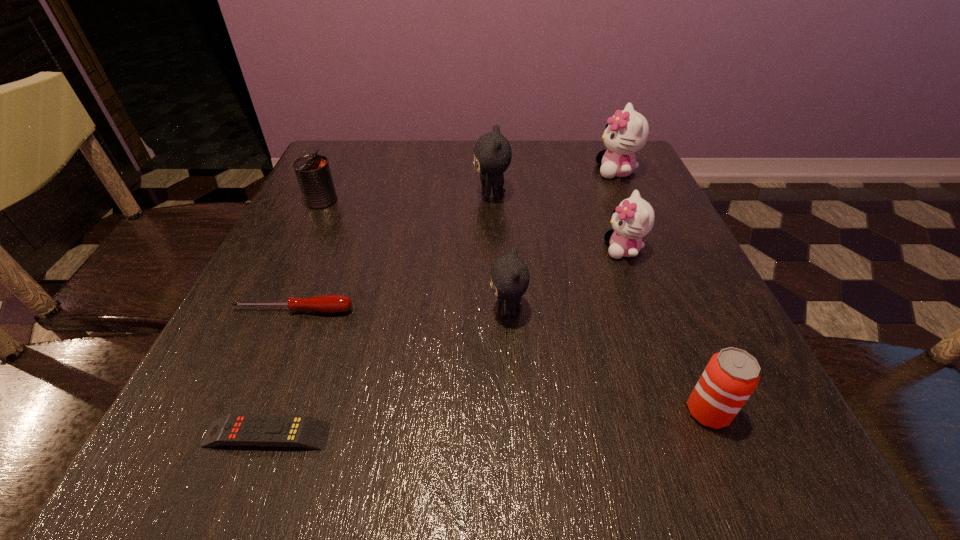
Locate an element on the screen. The width and height of the screenshot is (960, 540). the bigger white kitten is located at coordinates (626, 132).

In order to click on the farther gray kitten in this screenshot , I will do pos(492,153).

Where is `can`? The image size is (960, 540). can is located at coordinates (313, 173).

Where is `the smaller white kitten`? the smaller white kitten is located at coordinates (633, 219).

You are a GUI agent. You are given a task and a screenshot of the screen. Output one action in this format:
    pyautogui.click(x=<x>, y=<y>)
    Task: Click on the nearer white kitten
    This screenshot has width=960, height=540.
    Given the screenshot: What is the action you would take?
    pyautogui.click(x=633, y=219)

This screenshot has height=540, width=960. Find the location of `the smaller gray kitten`. the smaller gray kitten is located at coordinates (510, 277).

Locate an element on the screen. the nearer gray kitten is located at coordinates (510, 277).

Identify the location of beer can. 731,376.

This screenshot has width=960, height=540. In order to click on the second shortest object in this screenshot , I will do `click(331, 303)`.

Locate an element on the screen. This screenshot has height=540, width=960. screwdriver is located at coordinates (331, 303).